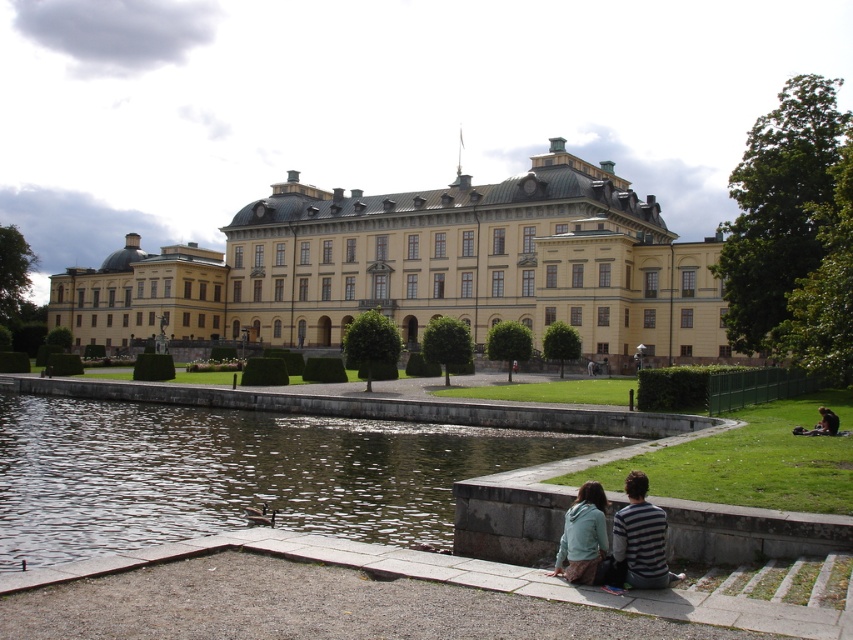
Question: Does clear water at pond center lie in front of blue denim jacket at lower center?

Choices:
 (A) yes
 (B) no

Answer: (B)

Question: Estimate the real-world distances between objects in this image. Which object is farther from the blue denim jacket at lower center?

Choices:
 (A) clear water at pond center
 (B) light blue hoodie at lower center
 (C) yellow stone building at center

Answer: (C)

Question: Estimate the real-world distances between objects in this image. Which object is farther from the blue denim jacket at lower center?

Choices:
 (A) light blue hoodie at lower center
 (B) clear water at pond center

Answer: (B)

Question: Among these points, which one is nearest to the camera?

Choices:
 (A) (360, 513)
 (B) (648, 568)

Answer: (B)

Question: Can you confirm if clear water at pond center is smaller than light blue hoodie at lower center?

Choices:
 (A) no
 (B) yes

Answer: (A)

Question: Can you confirm if yellow stone building at center is positioned above light blue hoodie at lower center?

Choices:
 (A) yes
 (B) no

Answer: (A)